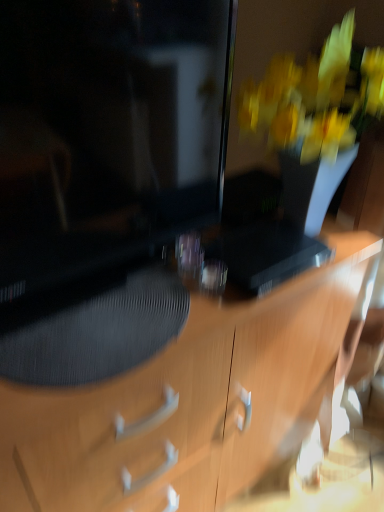
Describe the element at coordinates (131, 146) in the screenshot. This screenshot has height=512, width=384. I see `matte black monitor at left` at that location.

At what (x,y) coordinates should I click in order to perform the action: click on black textured drawer at center. Please return your answer as a coordinate pair (x, y). This screenshot has width=384, height=512. Looking at the image, I should click on (123, 429).

Which is closer, (211,430) or (229,25)?

Point (211,430).

Considering the sizes of objects wooden desk at center and matte black monitor at left in the image provided, who is thinner, wooden desk at center or matte black monitor at left?

With smaller width is matte black monitor at left.

Which is more to the right, wooden desk at center or matte black monitor at left?

wooden desk at center.

Does black textured drawer at center lie behind wooden desk at center?

That is True.

In terms of size, does black textured drawer at center appear bigger or smaller than wooden desk at center?

Clearly, black textured drawer at center is smaller in size than wooden desk at center.

From the image's perspective, is black textured drawer at center over wooden desk at center?

Yes, from the image's perspective, black textured drawer at center is above wooden desk at center.

Is black textured drawer at center inside matte black monitor at left?

No.

Could you tell me if matte black monitor at left is turned towards black textured drawer at center?

Yes, matte black monitor at left is facing black textured drawer at center.

From the picture: Can you confirm if matte black monitor at left is shorter than black textured drawer at center?

No.

Would you say matte black monitor at left is a long distance from black textured drawer at center?

No, matte black monitor at left is in close proximity to black textured drawer at center.

Between matte black monitor at left and wooden desk at center, which one has larger width?

wooden desk at center.

Considering the relative sizes of matte black monitor at left and wooden desk at center in the image provided, is matte black monitor at left bigger than wooden desk at center?

No.

Is matte black monitor at left oriented towards wooden desk at center?

No, matte black monitor at left is not oriented towards wooden desk at center.

Which is more to the right, matte black monitor at left or wooden desk at center?

wooden desk at center is more to the right.

Is wooden desk at center located outside black textured drawer at center?

wooden desk at center is positioned outside black textured drawer at center.

Is wooden desk at center turned away from black textured drawer at center?

No.

From the image's perspective, which one is positioned lower, wooden desk at center or black textured drawer at center?

wooden desk at center, from the image's perspective.

Which is more to the right, wooden desk at center or black textured drawer at center?

Positioned to the right is wooden desk at center.

How different are the orientations of black textured drawer at center and matte black monitor at left in degrees?

0.405 degrees.

Considering the positions of objects black textured drawer at center and matte black monitor at left in the image provided, who is more to the right, black textured drawer at center or matte black monitor at left?

matte black monitor at left is more to the right.

Is matte black monitor at left at the back of black textured drawer at center?

That's right, black textured drawer at center is facing away from matte black monitor at left.

Consider the image. Would you say black textured drawer at center is a long distance from matte black monitor at left?

They are positioned close to each other.

Where is `television located above the wooden desk at center (from the image's perspective)`? The width and height of the screenshot is (384, 512). television located above the wooden desk at center (from the image's perspective) is located at coordinates (131, 146).

At what (x,y) coordinates should I click in order to perform the action: click on desk on the right of black textured drawer at center. Please return your answer as a coordinate pair (x, y). This screenshot has width=384, height=512. Looking at the image, I should click on (192, 400).

Looking at the image, which one is located closer to wooden desk at center, matte black monitor at left or black textured drawer at center?

Among the two, black textured drawer at center is located nearer to wooden desk at center.

From the image, which object appears to be farther from black textured drawer at center, matte black monitor at left or wooden desk at center?

matte black monitor at left is positioned further to the anchor black textured drawer at center.

From the picture: Based on their spatial positions, is wooden desk at center or matte black monitor at left further from black textured drawer at center?

Answer: Among the two, matte black monitor at left is located further to black textured drawer at center.

Looking at this image, when comparing their distances from matte black monitor at left, does wooden desk at center or black textured drawer at center seem closer?

The object closer to matte black monitor at left is black textured drawer at center.

Looking at this image, estimate the real-world distances between objects in this image. Which object is further from wooden desk at center, black textured drawer at center or matte black monitor at left?

matte black monitor at left is positioned further to the anchor wooden desk at center.

When comparing their distances from matte black monitor at left, does black textured drawer at center or wooden desk at center seem further?

wooden desk at center.

You are a GUI agent. You are given a task and a screenshot of the screen. Output one action in this format:
    pyautogui.click(x=<x>, y=<y>)
    Task: Click on the drawer between matte black monitor at left and wooden desk at center in the vertical direction
    
    Given the screenshot: What is the action you would take?
    pyautogui.click(x=123, y=429)